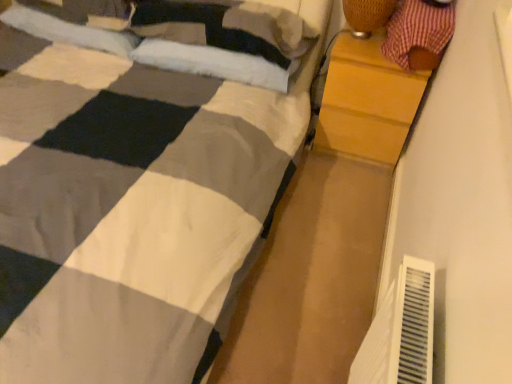
The height and width of the screenshot is (384, 512). Describe the element at coordinates (89, 11) in the screenshot. I see `soft white pillow at upper left, positioned as the second pillow in left-to-right order` at that location.

How much space does soft white pillow at upper left, which is counted as the 2th pillow, starting from the right, occupy vertically?

soft white pillow at upper left, which is counted as the 2th pillow, starting from the right, is 6.39 inches tall.

What is the approximate width of soft white pillow at upper left, positioned as the 3th pillow in right-to-left order?

soft white pillow at upper left, positioned as the 3th pillow in right-to-left order, is 13.84 inches in width.

What do you see at coordinates (418, 33) in the screenshot? This screenshot has height=384, width=512. I see `red plaid fabric at upper right` at bounding box center [418, 33].

The width and height of the screenshot is (512, 384). What do you see at coordinates (367, 101) in the screenshot?
I see `wooden chest of drawers at right` at bounding box center [367, 101].

What is the approximate width of woven bamboo lampshade at upper right?

woven bamboo lampshade at upper right is 9.01 inches in width.

This screenshot has width=512, height=384. Find the location of `white soft pillow at upper center, which ranks as the third pillow in left-to-right order`. white soft pillow at upper center, which ranks as the third pillow in left-to-right order is located at coordinates (212, 63).

Describe the element at coordinates (212, 63) in the screenshot. I see `white soft pillow at upper center, which is counted as the first pillow, starting from the right` at that location.

This screenshot has width=512, height=384. Identify the location of soft white pillow at upper left, which is counted as the 2th pillow, starting from the right. (89, 11).

Is red plaid fabric at upper right inside or outside of wooden chest of drawers at right?

red plaid fabric at upper right is spatially situated outside wooden chest of drawers at right.

Looking at this image, in the image, is red plaid fabric at upper right positioned in front of or behind wooden chest of drawers at right?

In the image, red plaid fabric at upper right appears in front of wooden chest of drawers at right.

Is red plaid fabric at upper right facing away from wooden chest of drawers at right?

No, red plaid fabric at upper right's orientation is not away from wooden chest of drawers at right.

From the image's perspective, does red plaid fabric at upper right appear lower than wooden chest of drawers at right?

Incorrect, from the image's perspective, red plaid fabric at upper right is higher than wooden chest of drawers at right.

Considering the positions of objects red plaid fabric at upper right and soft white pillow at upper left, positioned as the 3th pillow in right-to-left order, in the image provided, who is more to the right, red plaid fabric at upper right or soft white pillow at upper left, positioned as the 3th pillow in right-to-left order,?

red plaid fabric at upper right is more to the right.

This screenshot has height=384, width=512. There is a red plaid fabric at upper right. Identify the location of the 3rd pillow below it (from a real-world perspective). (128, 44).

Between red plaid fabric at upper right and soft white pillow at upper left, positioned as the 3th pillow in right-to-left order, which one has more height?

red plaid fabric at upper right.

Is red plaid fabric at upper right turned away from soft white pillow at upper left, positioned as the 3th pillow in right-to-left order?

No, red plaid fabric at upper right's orientation is not away from soft white pillow at upper left, positioned as the 3th pillow in right-to-left order.

In the scene shown: Does white soft pillow at upper center, which ranks as the third pillow in left-to-right order, have a larger size compared to wooden chest of drawers at right?

Incorrect, white soft pillow at upper center, which ranks as the third pillow in left-to-right order, is not larger than wooden chest of drawers at right.

From a real-world perspective, count 2nd pillows upward from the wooden chest of drawers at right and point to it. Please provide its 2D coordinates.

[(212, 63)]

Would you say wooden chest of drawers at right is part of white soft pillow at upper center, which ranks as the third pillow in left-to-right order,'s contents?

No, wooden chest of drawers at right is not inside white soft pillow at upper center, which ranks as the third pillow in left-to-right order.

From a real-world perspective, is white soft pillow at upper center, which is counted as the first pillow, starting from the right, positioned above or below wooden chest of drawers at right?

In terms of real-world spatial position, white soft pillow at upper center, which is counted as the first pillow, starting from the right, is above wooden chest of drawers at right.

Looking at their sizes, would you say soft white pillow at upper left, positioned as the 3th pillow in right-to-left order, is wider or thinner than wooden chest of drawers at right?

Clearly, soft white pillow at upper left, positioned as the 3th pillow in right-to-left order, has less width compared to wooden chest of drawers at right.

Is soft white pillow at upper left, positioned as the 3th pillow in right-to-left order, spatially inside wooden chest of drawers at right, or outside of it?

soft white pillow at upper left, positioned as the 3th pillow in right-to-left order, is spatially situated outside wooden chest of drawers at right.

At what (x,y) coordinates should I click in order to perform the action: click on pillow that is the 2nd one when counting upward from the wooden chest of drawers at right (from the image's perspective). Please return your answer as a coordinate pair (x, y). The width and height of the screenshot is (512, 384). Looking at the image, I should click on (128, 44).

Is soft white pillow at upper left, the first pillow in the left-to-right sequence, placed right next to wooden chest of drawers at right?

No.

Considering the positions of points (169, 67) and (113, 49), is point (169, 67) closer to camera compared to point (113, 49)?

Yes, it is.

Is white soft pillow at upper center, which is counted as the first pillow, starting from the right, wider than soft white pillow at upper left, the first pillow in the left-to-right sequence?

Yes.

Is white soft pillow at upper center, which ranks as the third pillow in left-to-right order, not within soft white pillow at upper left, positioned as the 3th pillow in right-to-left order?

Yes.

Is white soft pillow at upper center, which ranks as the third pillow in left-to-right order, beside soft white pillow at upper left, the first pillow in the left-to-right sequence?

They are not placed beside each other.

How much distance is there between white soft pillow at upper center, which is counted as the first pillow, starting from the right, and woven bamboo lampshade at upper right?

white soft pillow at upper center, which is counted as the first pillow, starting from the right, and woven bamboo lampshade at upper right are 55.15 centimeters apart.

Who is more distant, white soft pillow at upper center, which is counted as the first pillow, starting from the right, or woven bamboo lampshade at upper right?

white soft pillow at upper center, which is counted as the first pillow, starting from the right, is behind.

Which is correct: white soft pillow at upper center, which is counted as the first pillow, starting from the right, is inside woven bamboo lampshade at upper right, or outside of it?

white soft pillow at upper center, which is counted as the first pillow, starting from the right, cannot be found inside woven bamboo lampshade at upper right.

What are the coordinates of `the chest of drawers beneath the soft white pillow at upper left, which is counted as the 2th pillow, starting from the right (from a real-world perspective)` in the screenshot? It's located at (367, 101).

Does soft white pillow at upper left, which is counted as the 2th pillow, starting from the right, have a smaller size compared to wooden chest of drawers at right?

Yes.

At what (x,y) coordinates should I click in order to perform the action: click on chest of drawers lying on the left of red plaid fabric at upper right. Please return your answer as a coordinate pair (x, y). Looking at the image, I should click on (367, 101).

Find the location of a particular element. This screenshot has height=384, width=512. the 3rd pillow behind the red plaid fabric at upper right is located at coordinates (128, 44).

When comparing their distances from white soft pillow at upper center, which is counted as the first pillow, starting from the right, does red plaid fabric at upper right or wooden chest of drawers at right seem further?

The object further to white soft pillow at upper center, which is counted as the first pillow, starting from the right, is red plaid fabric at upper right.

In the scene shown: Which object lies nearer to the anchor point wooden chest of drawers at right, soft white pillow at upper left, positioned as the second pillow in left-to-right order, or woven bamboo lampshade at upper right?

Based on the image, woven bamboo lampshade at upper right appears to be nearer to wooden chest of drawers at right.

Which object lies nearer to the anchor point woven bamboo lampshade at upper right, soft white pillow at upper left, positioned as the second pillow in left-to-right order, or wooden chest of drawers at right?

Based on the image, wooden chest of drawers at right appears to be nearer to woven bamboo lampshade at upper right.

When comparing their distances from white soft pillow at upper center, which ranks as the third pillow in left-to-right order, does wooden chest of drawers at right or red plaid fabric at upper right seem further?

The object further to white soft pillow at upper center, which ranks as the third pillow in left-to-right order, is red plaid fabric at upper right.

From the image, which object appears to be nearer to red plaid fabric at upper right, white soft pillow at upper center, which is counted as the first pillow, starting from the right, or soft white pillow at upper left, positioned as the 3th pillow in right-to-left order?

Among the two, white soft pillow at upper center, which is counted as the first pillow, starting from the right, is located nearer to red plaid fabric at upper right.

Looking at the image, which one is located further to soft white pillow at upper left, which is counted as the 2th pillow, starting from the right, white soft pillow at upper center, which is counted as the first pillow, starting from the right, or woven bamboo lampshade at upper right?

Among the two, woven bamboo lampshade at upper right is located further to soft white pillow at upper left, which is counted as the 2th pillow, starting from the right.

Looking at the image, which one is located closer to soft white pillow at upper left, the first pillow in the left-to-right sequence, wooden chest of drawers at right or white soft pillow at upper center, which is counted as the first pillow, starting from the right?

Based on the image, white soft pillow at upper center, which is counted as the first pillow, starting from the right, appears to be nearer to soft white pillow at upper left, the first pillow in the left-to-right sequence.

Based on their spatial positions, is soft white pillow at upper left, positioned as the 3th pillow in right-to-left order, or wooden chest of drawers at right closer to soft white pillow at upper left, which is counted as the 2th pillow, starting from the right?

soft white pillow at upper left, positioned as the 3th pillow in right-to-left order, is closer to soft white pillow at upper left, which is counted as the 2th pillow, starting from the right.

Where is `lamp located between soft white pillow at upper left, which is counted as the 2th pillow, starting from the right, and wooden chest of drawers at right in the left-right direction`? Image resolution: width=512 pixels, height=384 pixels. lamp located between soft white pillow at upper left, which is counted as the 2th pillow, starting from the right, and wooden chest of drawers at right in the left-right direction is located at coordinates tap(367, 15).

You are a GUI agent. You are given a task and a screenshot of the screen. Output one action in this format:
    pyautogui.click(x=<x>, y=<y>)
    Task: Click on the pillow located between soft white pillow at upper left, the first pillow in the left-to-right sequence, and white soft pillow at upper center, which is counted as the first pillow, starting from the right, in the left-right direction
    Image resolution: width=512 pixels, height=384 pixels.
    Given the screenshot: What is the action you would take?
    pyautogui.click(x=89, y=11)

The width and height of the screenshot is (512, 384). I want to click on pillow located between soft white pillow at upper left, which is counted as the 2th pillow, starting from the right, and red plaid fabric at upper right in the left-right direction, so click(x=212, y=63).

Locate an element on the screen. The height and width of the screenshot is (384, 512). lamp located between soft white pillow at upper left, the first pillow in the left-to-right sequence, and wooden chest of drawers at right in the left-right direction is located at coordinates (367, 15).